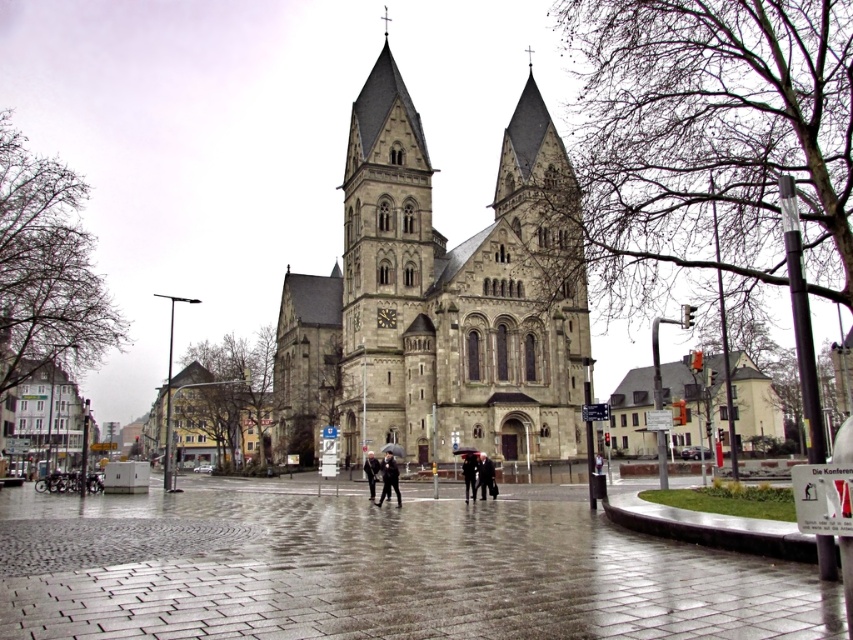
Question: Estimate the real-world distances between objects in this image. Which object is farther from the gray stone church at center?

Choices:
 (A) dark gray suit at center
 (B) dark gray fabric umbrella at center
 (C) dark gray coat at center
 (D) dark gray fabric coat at center

Answer: (B)

Question: Which of the following is the farthest from the observer?

Choices:
 (A) dark gray fabric coat at center
 (B) dark gray coat at center
 (C) dark gray suit at center
 (D) dark gray fabric umbrella at center

Answer: (A)

Question: Does dark gray coat at center appear on the right side of dark gray fabric coat at center?

Choices:
 (A) no
 (B) yes

Answer: (B)

Question: Is gray stone church at center wider than dark gray suit at center?

Choices:
 (A) no
 (B) yes

Answer: (B)

Question: Which point appears farthest from the camera in this image?

Choices:
 (A) (473, 481)
 (B) (389, 461)
 (C) (370, 477)

Answer: (C)

Question: Is gray stone church at center to the left of dark gray fabric coat at center from the viewer's perspective?

Choices:
 (A) no
 (B) yes

Answer: (A)